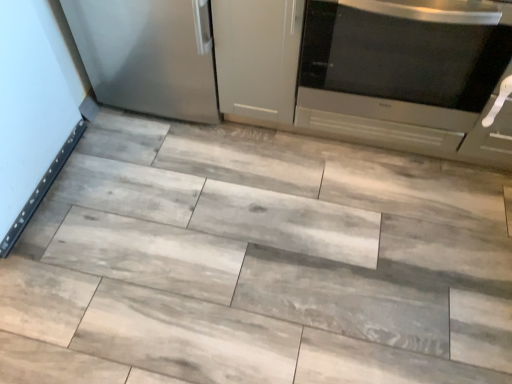
Question: From the image's perspective, is satin metallic refrigerator at left on gray wood tile at center?

Choices:
 (A) no
 (B) yes

Answer: (B)

Question: Would you say satin metallic refrigerator at left contains gray wood tile at center?

Choices:
 (A) yes
 (B) no

Answer: (B)

Question: Would you consider satin metallic refrigerator at left to be distant from gray wood tile at center?

Choices:
 (A) yes
 (B) no

Answer: (B)

Question: From the image's perspective, is satin metallic refrigerator at left located beneath gray wood tile at center?

Choices:
 (A) yes
 (B) no

Answer: (B)

Question: Is satin metallic refrigerator at left positioned before gray wood tile at center?

Choices:
 (A) yes
 (B) no

Answer: (B)

Question: Can you confirm if satin metallic refrigerator at left is thinner than gray wood tile at center?

Choices:
 (A) no
 (B) yes

Answer: (B)

Question: Considering the relative sizes of gray wood tile at center and satin silver microwave at right in the image provided, is gray wood tile at center taller than satin silver microwave at right?

Choices:
 (A) no
 (B) yes

Answer: (A)

Question: Does gray wood tile at center have a larger size compared to satin silver microwave at right?

Choices:
 (A) no
 (B) yes

Answer: (A)

Question: Are gray wood tile at center and satin silver microwave at right far apart?

Choices:
 (A) yes
 (B) no

Answer: (B)

Question: Can you confirm if gray wood tile at center is positioned to the left of satin silver microwave at right?

Choices:
 (A) no
 (B) yes

Answer: (B)

Question: Is satin silver microwave at right located within gray wood tile at center?

Choices:
 (A) yes
 (B) no

Answer: (B)

Question: From the image's perspective, is gray wood tile at center on top of satin silver microwave at right?

Choices:
 (A) no
 (B) yes

Answer: (A)

Question: From a real-world perspective, is gray wood tile at center located beneath satin metallic refrigerator at left?

Choices:
 (A) yes
 (B) no

Answer: (A)